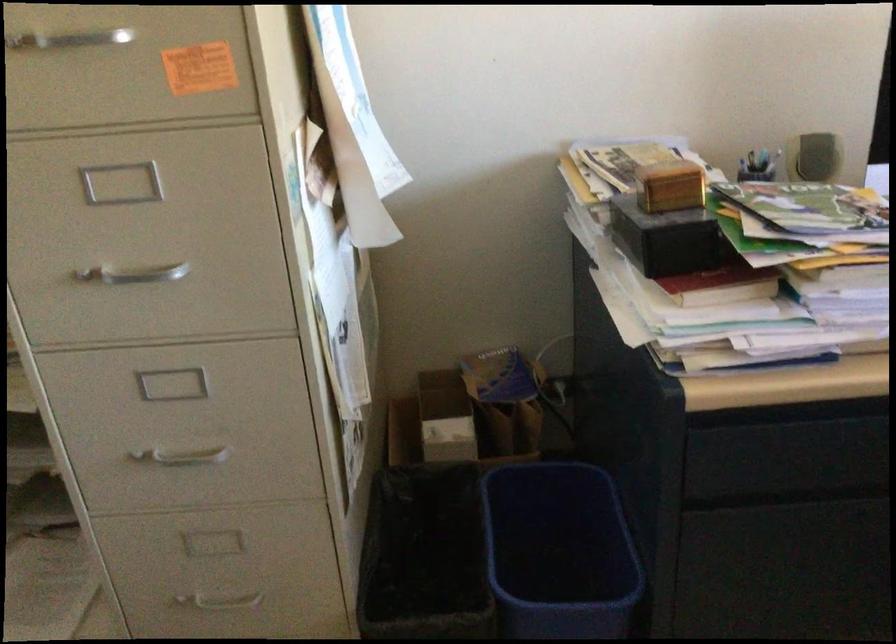
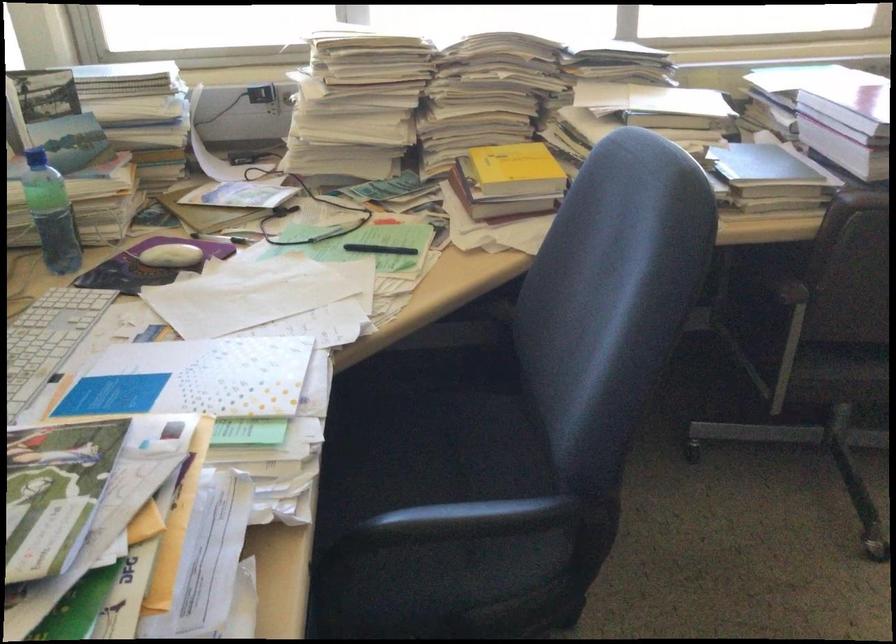
How did the camera likely rotate?

The camera rotated toward right-down.